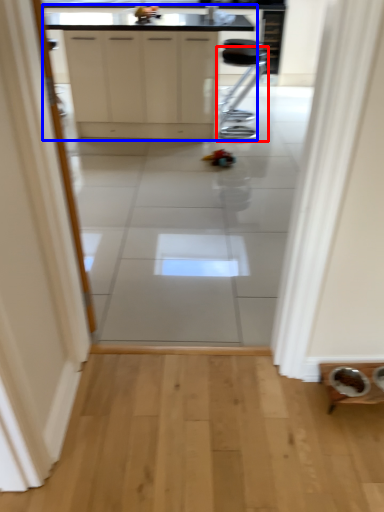
Question: Which point is closer to the camera, furniture (highlighted by a red box) or cabinetry (highlighted by a blue box)?

Choices:
 (A) furniture
 (B) cabinetry

Answer: (B)